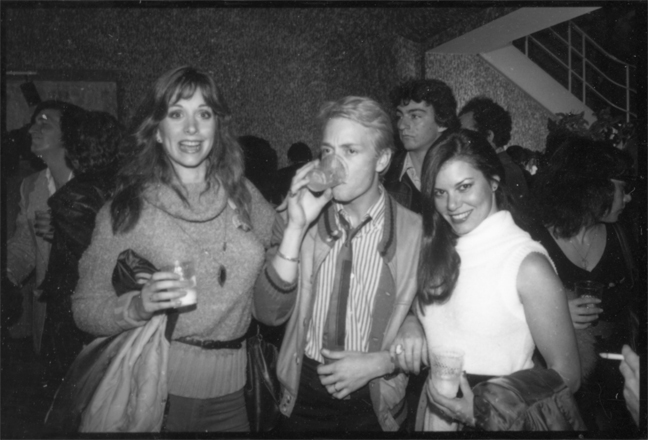
This screenshot has height=440, width=648. I want to click on drinking glasses, so click(x=435, y=372), click(x=183, y=273), click(x=327, y=171), click(x=586, y=284).